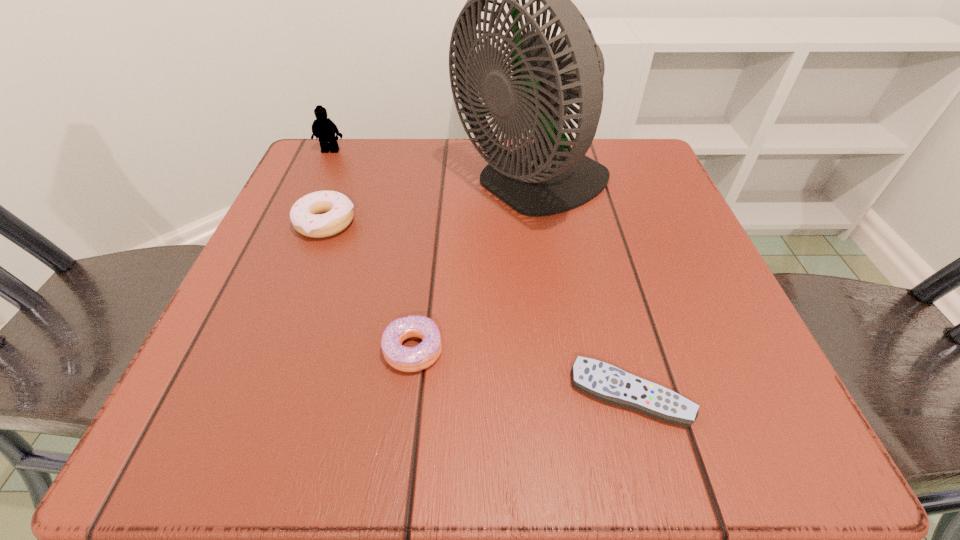
Find the location of a particular element. This screenshot has width=960, height=540. vacant region located 0.260m on the right of the nearer doughnut is located at coordinates (634, 350).

Identify the location of blank space located on the left of the shortest object. (349, 394).

Identify the location of fan present at the far edge. This screenshot has height=540, width=960. (546, 177).

Where is `Lego at the far edge`? This screenshot has width=960, height=540. Lego at the far edge is located at coordinates (323, 128).

Where is `object positioned at the near edge`? The width and height of the screenshot is (960, 540). object positioned at the near edge is located at coordinates (603, 381).

Find the location of `Lego that is at the left edge`. Lego that is at the left edge is located at coordinates (323, 128).

Identify the location of doughnut positioned at the left edge. The width and height of the screenshot is (960, 540). (305, 216).

Where is `fan positioned at the right edge`? The image size is (960, 540). fan positioned at the right edge is located at coordinates (546, 177).

Find the location of a particular element. The height and width of the screenshot is (540, 960). remote control located at the right edge is located at coordinates (603, 381).

Locate an element on the screen. object positioned at the far left corner is located at coordinates (323, 128).